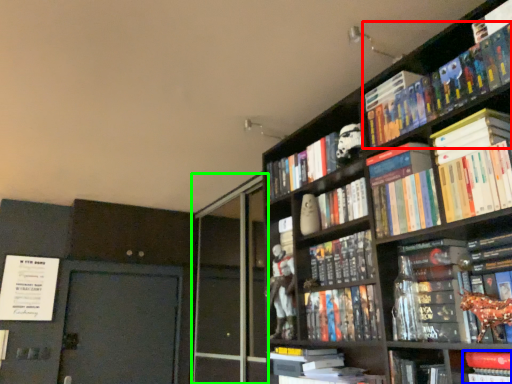
Question: Which object is positioned farthest from book (highlighted by a red box)? Select from book (highlighted by a blue box) and screen door (highlighted by a green box).

Choices:
 (A) book
 (B) screen door

Answer: (B)